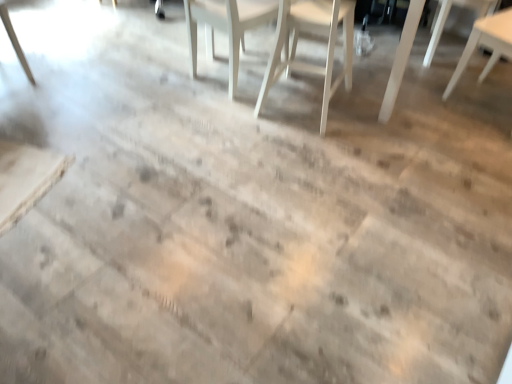
This screenshot has width=512, height=384. In order to click on free spot in front of white wood chair at center, which appears as the 2th chair when viewed from the left in this screenshot , I will do `click(308, 147)`.